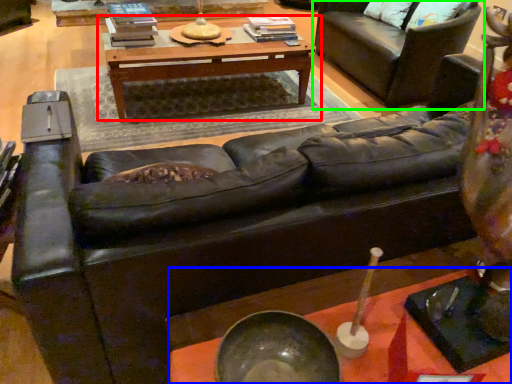
Question: Considering the real-world distances, which object is farthest from table (highlighted by a red box)? table (highlighted by a blue box) or studio couch (highlighted by a green box)?

Choices:
 (A) table
 (B) studio couch

Answer: (A)